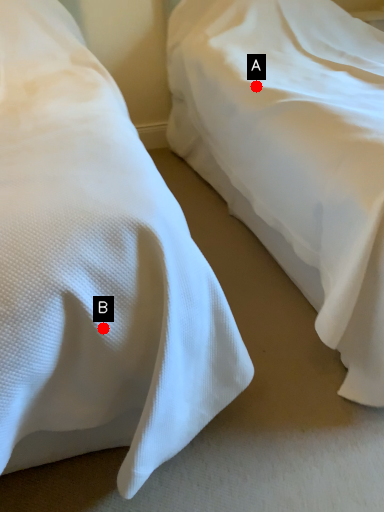
Question: Two points are circled on the image, labeled by A and B beside each circle. Among these points, which one is farthest from the camera?

Choices:
 (A) A is further
 (B) B is further

Answer: (A)